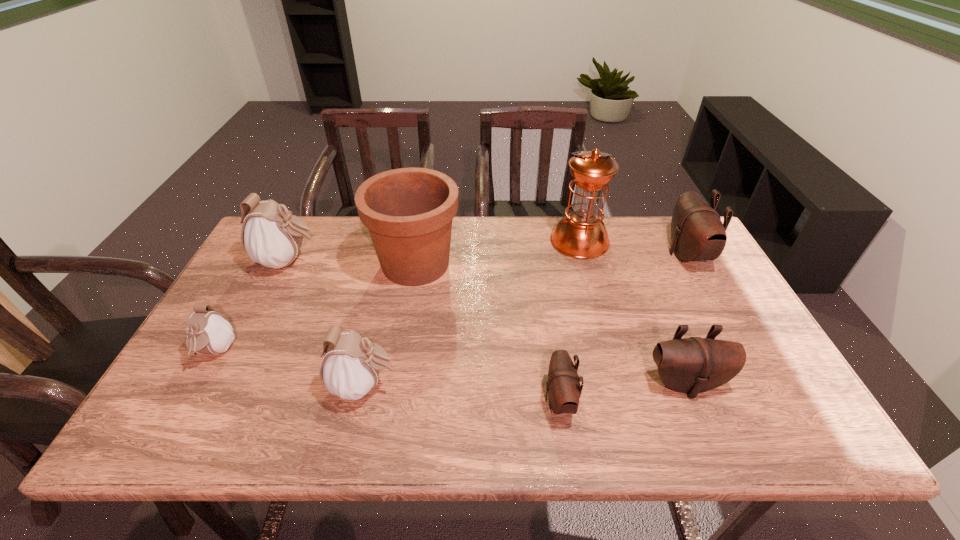
The height and width of the screenshot is (540, 960). I want to click on free space located on the front-facing side of the smallest white pouch, so click(186, 406).

The image size is (960, 540). In order to click on free space located 0.160m with the flap open on the smallest brown pouch in this screenshot , I will do `click(472, 400)`.

The width and height of the screenshot is (960, 540). I want to click on vacant point located 0.300m with the flap open on the smallest brown pouch, so click(x=411, y=400).

The image size is (960, 540). I want to click on free space located 0.250m with the flap open on the smallest brown pouch, so click(433, 400).

This screenshot has height=540, width=960. Identify the location of oil lamp located at the far edge. (581, 234).

Image resolution: width=960 pixels, height=540 pixels. What are the coordinates of `flowerpot that is positioned at the far edge` in the screenshot? It's located at (408, 211).

Where is `object at the far left corner`? object at the far left corner is located at coordinates (272, 237).

This screenshot has width=960, height=540. In order to click on object present at the far right corner in this screenshot , I will do `click(697, 232)`.

In the image, there is a desktop. What are the coordinates of `free space at the far edge` in the screenshot? It's located at (644, 236).

In the image, there is a desktop. Where is `free region at the near edge`? The height and width of the screenshot is (540, 960). free region at the near edge is located at coordinates (612, 435).